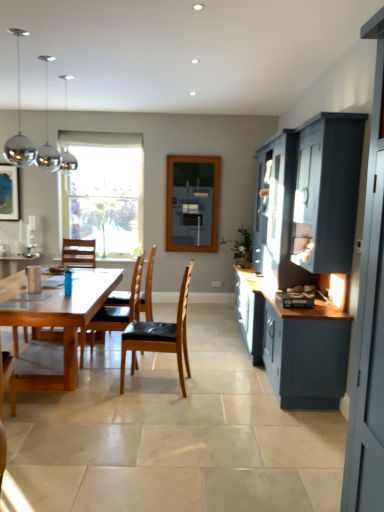
Question: Should I look upward or downward to see satin silver toaster at lower right?

Choices:
 (A) up
 (B) down

Answer: (B)

Question: Considering the relative sizes of satin silver toaster at lower right and brown leather chair at center, arranged as the first chair when viewed from the back, in the image provided, is satin silver toaster at lower right smaller than brown leather chair at center, arranged as the first chair when viewed from the back,?

Choices:
 (A) yes
 (B) no

Answer: (A)

Question: Is satin silver toaster at lower right completely or partially outside of brown leather chair at center, which is the third chair in front-to-back order?

Choices:
 (A) yes
 (B) no

Answer: (A)

Question: Is satin silver toaster at lower right oriented away from brown leather chair at center, arranged as the first chair when viewed from the back?

Choices:
 (A) no
 (B) yes

Answer: (A)

Question: Is satin silver toaster at lower right beside brown leather chair at center, arranged as the first chair when viewed from the back?

Choices:
 (A) no
 (B) yes

Answer: (A)

Question: Considering the relative sizes of satin silver toaster at lower right and brown leather chair at center, which is the third chair in front-to-back order, in the image provided, is satin silver toaster at lower right thinner than brown leather chair at center, which is the third chair in front-to-back order,?

Choices:
 (A) no
 (B) yes

Answer: (B)

Question: From a real-world perspective, is satin silver toaster at lower right under brown leather chair at center, arranged as the first chair when viewed from the back?

Choices:
 (A) yes
 (B) no

Answer: (B)

Question: Are satin silver toaster at lower right and wooden chair with black seat cushion at center, which appears as the 2th chair when viewed from the back, located far from each other?

Choices:
 (A) no
 (B) yes

Answer: (B)

Question: Can you confirm if satin silver toaster at lower right is smaller than wooden chair with black seat cushion at center, which appears as the 2th chair when viewed from the back?

Choices:
 (A) no
 (B) yes

Answer: (B)

Question: From the image's perspective, is satin silver toaster at lower right over wooden chair with black seat cushion at center, arranged as the second chair when viewed from the front?

Choices:
 (A) yes
 (B) no

Answer: (A)

Question: Does satin silver toaster at lower right appear on the right side of wooden chair with black seat cushion at center, which appears as the 2th chair when viewed from the back?

Choices:
 (A) no
 (B) yes

Answer: (B)

Question: Is satin silver toaster at lower right completely or partially outside of wooden chair with black seat cushion at center, which appears as the 2th chair when viewed from the back?

Choices:
 (A) no
 (B) yes

Answer: (B)

Question: Is satin silver toaster at lower right facing away from wooden chair with black seat cushion at center, arranged as the second chair when viewed from the front?

Choices:
 (A) no
 (B) yes

Answer: (A)

Question: Is brown leather chair at center, which is the third chair in front-to-back order, not close to light brown wooden table at center?

Choices:
 (A) yes
 (B) no

Answer: (B)